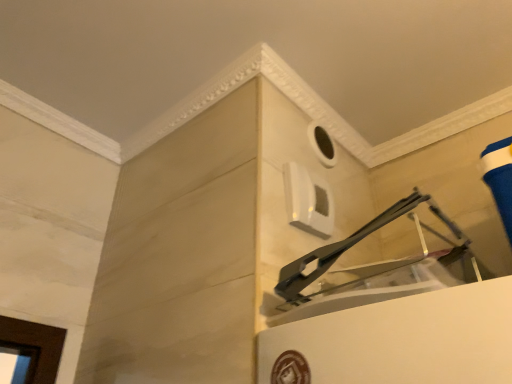
Question: Is point tap(292, 165) positioned closer to the camera than point tap(328, 134)?

Choices:
 (A) farther
 (B) closer

Answer: (B)

Question: Do you think white plastic window at upper center is within white matte hole at upper center, or outside of it?

Choices:
 (A) outside
 (B) inside

Answer: (A)

Question: From the image's perspective, is white plastic window at upper center located above or below white matte hole at upper center?

Choices:
 (A) below
 (B) above

Answer: (A)

Question: In terms of width, does white matte hole at upper center look wider or thinner when compared to white plastic window at upper center?

Choices:
 (A) thin
 (B) wide

Answer: (A)

Question: Is white matte hole at upper center bigger or smaller than white plastic window at upper center?

Choices:
 (A) big
 (B) small

Answer: (B)

Question: Choose the correct answer: Is white matte hole at upper center inside white plastic window at upper center or outside it?

Choices:
 (A) outside
 (B) inside

Answer: (A)

Question: From the image's perspective, is white matte hole at upper center above or below white plastic window at upper center?

Choices:
 (A) above
 (B) below

Answer: (A)